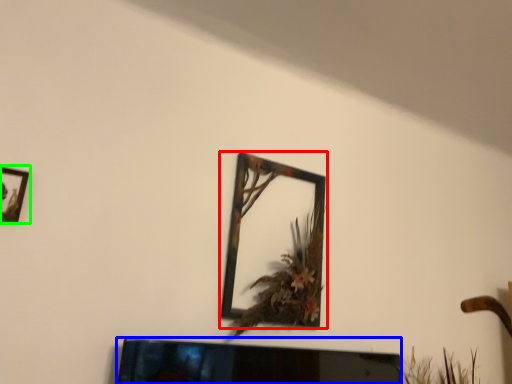
Question: Which object is positioned farthest from picture frame (highlighted by a red box)? Select from television (highlighted by a blue box) and picture frame (highlighted by a green box).

Choices:
 (A) television
 (B) picture frame

Answer: (B)